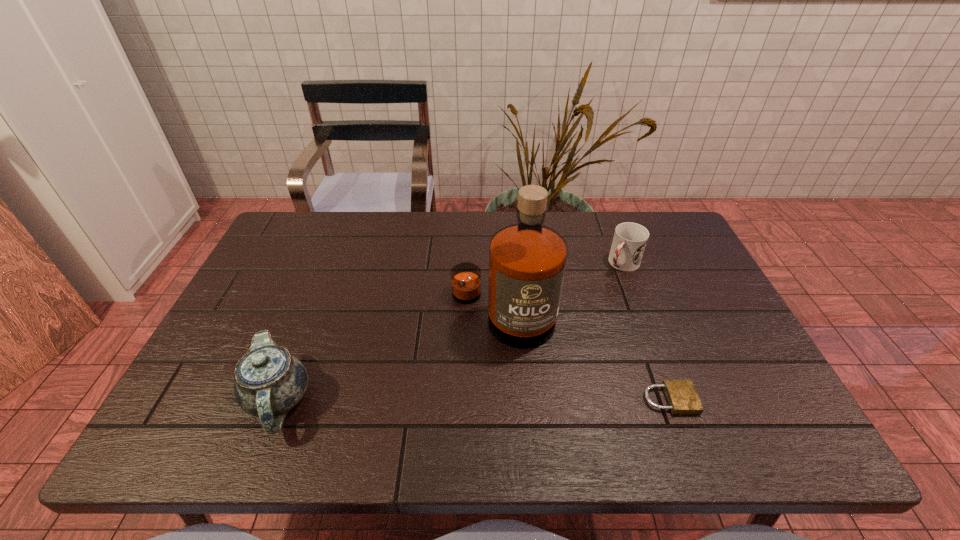
At what (x,y) coordinates should I click in order to perform the action: click on chinaware. Please return your answer as a coordinate pair (x, y). The image size is (960, 540). Looking at the image, I should click on (269, 381).

Where is `the third shortest object`? This screenshot has width=960, height=540. the third shortest object is located at coordinates (269, 381).

Where is `padlock`? The height and width of the screenshot is (540, 960). padlock is located at coordinates (682, 397).

This screenshot has height=540, width=960. I want to click on cup, so click(630, 239).

Identify the location of the third tallest object. This screenshot has width=960, height=540. (630, 239).

This screenshot has height=540, width=960. What are the coordinates of `liquor` in the screenshot? It's located at (527, 260).

Identify the location of the second object from left to right. (527, 260).

The height and width of the screenshot is (540, 960). In order to click on free space located on the keyhole side of the padlock in this screenshot , I will do click(x=753, y=400).

In order to click on free space located on the side of the cup where the handle is located in this screenshot , I will do `click(584, 307)`.

You are a GUI agent. You are given a task and a screenshot of the screen. Output one action in this format:
    pyautogui.click(x=<x>, y=<y>)
    Task: Click on the blank space located on the side of the cup where the handle is located
    
    Given the screenshot: What is the action you would take?
    pyautogui.click(x=586, y=305)